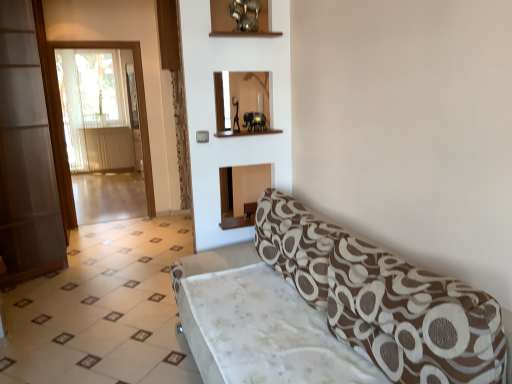
Identify the location of vacant area that is in front of transparent glass screen door at left, the 2th screen door in the front-to-back sequence. The height and width of the screenshot is (384, 512). (110, 231).